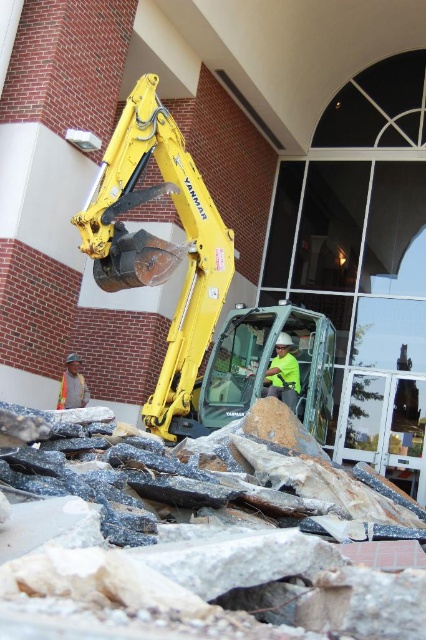
Question: Is yellow metallic excavator at center to the left of neon green safety vest at center from the viewer's perspective?

Choices:
 (A) no
 (B) yes

Answer: (B)

Question: Considering the relative positions of yellow metallic excavator at center and orange safety vest at lower left in the image provided, where is yellow metallic excavator at center located with respect to orange safety vest at lower left?

Choices:
 (A) left
 (B) right

Answer: (B)

Question: Which is nearer to the neon green safety vest at center?

Choices:
 (A) yellow metallic excavator at center
 (B) orange safety vest at lower left

Answer: (A)

Question: Which object is positioned closest to the orange safety vest at lower left?

Choices:
 (A) neon green safety vest at center
 (B) yellow metallic excavator at center

Answer: (B)

Question: Is yellow metallic excavator at center below orange safety vest at lower left?

Choices:
 (A) yes
 (B) no

Answer: (B)

Question: Which object is farther from the camera taking this photo?

Choices:
 (A) neon green safety vest at center
 (B) orange safety vest at lower left
 (C) yellow metallic excavator at center

Answer: (B)